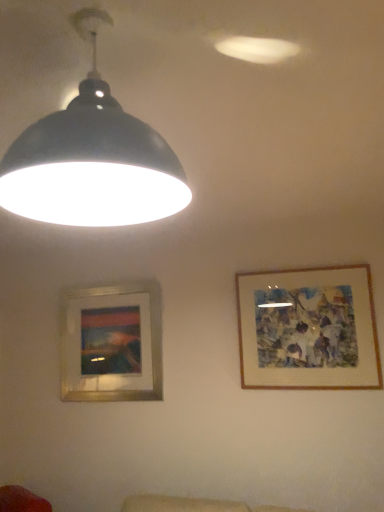
What is the approximate width of matte black lampshade at upper left?

41.38 centimeters.

Where is `wooden-framed artwork at upper right, which ranks as the first picture frame in front-to-back order`? The width and height of the screenshot is (384, 512). wooden-framed artwork at upper right, which ranks as the first picture frame in front-to-back order is located at coordinates (308, 329).

Measure the distance between silver metallic picture frame at lower left, the 1th picture frame positioned from the back, and matte black lampshade at upper left.

silver metallic picture frame at lower left, the 1th picture frame positioned from the back, and matte black lampshade at upper left are 2.10 meters apart from each other.

From their relative heights in the image, would you say silver metallic picture frame at lower left, the 1th picture frame positioned from the back, is taller or shorter than matte black lampshade at upper left?

In the image, silver metallic picture frame at lower left, the 1th picture frame positioned from the back, appears to be taller than matte black lampshade at upper left.

Is silver metallic picture frame at lower left, which ranks as the second picture frame in right-to-left order, far away from matte black lampshade at upper left?

Yes.

Considering the positions of objects silver metallic picture frame at lower left, which ranks as the second picture frame in right-to-left order, and wooden-framed artwork at upper right, acting as the 2th picture frame starting from the back, in the image provided, who is behind, silver metallic picture frame at lower left, which ranks as the second picture frame in right-to-left order, or wooden-framed artwork at upper right, acting as the 2th picture frame starting from the back,?

silver metallic picture frame at lower left, which ranks as the second picture frame in right-to-left order.

Which of these two, silver metallic picture frame at lower left, which ranks as the second picture frame in right-to-left order, or wooden-framed artwork at upper right, the first picture frame positioned from the right, stands shorter?

Standing shorter between the two is wooden-framed artwork at upper right, the first picture frame positioned from the right.

How many degrees apart are the facing directions of silver metallic picture frame at lower left, arranged as the 2th picture frame when viewed from the front, and wooden-framed artwork at upper right, acting as the 2th picture frame starting from the back?

The angular difference between silver metallic picture frame at lower left, arranged as the 2th picture frame when viewed from the front, and wooden-framed artwork at upper right, acting as the 2th picture frame starting from the back, is 0.00235 degrees.

The image size is (384, 512). Find the location of `picture frame below the wooden-framed artwork at upper right, which appears as the second picture frame when viewed from the left (from the image's perspective)`. picture frame below the wooden-framed artwork at upper right, which appears as the second picture frame when viewed from the left (from the image's perspective) is located at coordinates (111, 344).

Which object is wider, wooden-framed artwork at upper right, which ranks as the first picture frame in front-to-back order, or matte black lampshade at upper left?

matte black lampshade at upper left is wider.

Based on the photo, from a real-world perspective, does wooden-framed artwork at upper right, the first picture frame positioned from the right, sit lower than matte black lampshade at upper left?

Indeed, from a real-world perspective, wooden-framed artwork at upper right, the first picture frame positioned from the right, is positioned beneath matte black lampshade at upper left.

How far apart are wooden-framed artwork at upper right, which appears as the second picture frame when viewed from the left, and matte black lampshade at upper left?

A distance of 1.93 meters exists between wooden-framed artwork at upper right, which appears as the second picture frame when viewed from the left, and matte black lampshade at upper left.

Is wooden-framed artwork at upper right, the first picture frame positioned from the right, next to matte black lampshade at upper left and touching it?

No, wooden-framed artwork at upper right, the first picture frame positioned from the right, is not in contact with matte black lampshade at upper left.

Do you think wooden-framed artwork at upper right, which appears as the second picture frame when viewed from the left, is within silver metallic picture frame at lower left, arranged as the 2th picture frame when viewed from the front, or outside of it?

The correct answer is: outside.

In order to click on picture frame below the wooden-framed artwork at upper right, which ranks as the first picture frame in front-to-back order (from the image's perspective) in this screenshot , I will do point(111,344).

Considering the positions of objects wooden-framed artwork at upper right, the first picture frame positioned from the right, and silver metallic picture frame at lower left, arranged as the 2th picture frame when viewed from the front, in the image provided, who is more to the left, wooden-framed artwork at upper right, the first picture frame positioned from the right, or silver metallic picture frame at lower left, arranged as the 2th picture frame when viewed from the front,?

Positioned to the left is silver metallic picture frame at lower left, arranged as the 2th picture frame when viewed from the front.

Which of these two, wooden-framed artwork at upper right, which ranks as the first picture frame in front-to-back order, or silver metallic picture frame at lower left, the 1th picture frame positioned from the back, stands shorter?

Standing shorter between the two is wooden-framed artwork at upper right, which ranks as the first picture frame in front-to-back order.

From the image's perspective, which one is positioned lower, matte black lampshade at upper left or wooden-framed artwork at upper right, the first picture frame positioned from the right?

wooden-framed artwork at upper right, the first picture frame positioned from the right, is shown below in the image.

Which is more to the right, matte black lampshade at upper left or wooden-framed artwork at upper right, which appears as the second picture frame when viewed from the left?

wooden-framed artwork at upper right, which appears as the second picture frame when viewed from the left.

Looking at their sizes, would you say matte black lampshade at upper left is wider or thinner than wooden-framed artwork at upper right, which appears as the second picture frame when viewed from the left?

In the image, matte black lampshade at upper left appears to be wider than wooden-framed artwork at upper right, which appears as the second picture frame when viewed from the left.

Who is taller, matte black lampshade at upper left or wooden-framed artwork at upper right, which ranks as the first picture frame in front-to-back order?

With more height is wooden-framed artwork at upper right, which ranks as the first picture frame in front-to-back order.

Starting from the matte black lampshade at upper left, which picture frame is the 2nd one behind? Please provide its 2D coordinates.

[(111, 344)]

Which is more to the right, matte black lampshade at upper left or silver metallic picture frame at lower left, the 1th picture frame positioned from the back?

From the viewer's perspective, matte black lampshade at upper left appears more on the right side.

Is matte black lampshade at upper left turned away from silver metallic picture frame at lower left, which ranks as the second picture frame in right-to-left order?

No.

Between matte black lampshade at upper left and silver metallic picture frame at lower left, which ranks as the second picture frame in right-to-left order, which one has larger width?

Wider between the two is matte black lampshade at upper left.

Where is `lamp above the silver metallic picture frame at lower left, the first picture frame viewed from the left (from the image's perspective)`? This screenshot has height=512, width=384. lamp above the silver metallic picture frame at lower left, the first picture frame viewed from the left (from the image's perspective) is located at coordinates (92, 159).

At what (x,y) coordinates should I click in order to perform the action: click on picture frame above the silver metallic picture frame at lower left, the 1th picture frame positioned from the back (from a real-world perspective). Please return your answer as a coordinate pair (x, y). Looking at the image, I should click on (308, 329).

Looking at the image, which one is located closer to silver metallic picture frame at lower left, which ranks as the second picture frame in right-to-left order, wooden-framed artwork at upper right, the first picture frame positioned from the right, or matte black lampshade at upper left?

wooden-framed artwork at upper right, the first picture frame positioned from the right, is positioned closer to the anchor silver metallic picture frame at lower left, which ranks as the second picture frame in right-to-left order.

Considering their positions, is silver metallic picture frame at lower left, the 1th picture frame positioned from the back, positioned closer to wooden-framed artwork at upper right, which appears as the second picture frame when viewed from the left, than matte black lampshade at upper left?

silver metallic picture frame at lower left, the 1th picture frame positioned from the back.

Looking at this image, from the image, which object appears to be farther from matte black lampshade at upper left, silver metallic picture frame at lower left, arranged as the 2th picture frame when viewed from the front, or wooden-framed artwork at upper right, which appears as the second picture frame when viewed from the left?

silver metallic picture frame at lower left, arranged as the 2th picture frame when viewed from the front, lies further to matte black lampshade at upper left than the other object.

Considering their positions, is matte black lampshade at upper left positioned further to silver metallic picture frame at lower left, the first picture frame viewed from the left, than wooden-framed artwork at upper right, which ranks as the first picture frame in front-to-back order?

matte black lampshade at upper left.

Estimate the real-world distances between objects in this image. Which object is further from matte black lampshade at upper left, wooden-framed artwork at upper right, which ranks as the first picture frame in front-to-back order, or silver metallic picture frame at lower left, the first picture frame viewed from the left?

Among the two, silver metallic picture frame at lower left, the first picture frame viewed from the left, is located further to matte black lampshade at upper left.

Based on their spatial positions, is matte black lampshade at upper left or silver metallic picture frame at lower left, the 1th picture frame positioned from the back, further from wooden-framed artwork at upper right, which ranks as the first picture frame in front-to-back order?

Based on the image, matte black lampshade at upper left appears to be further to wooden-framed artwork at upper right, which ranks as the first picture frame in front-to-back order.

Image resolution: width=384 pixels, height=512 pixels. In order to click on picture frame between matte black lampshade at upper left and silver metallic picture frame at lower left, the first picture frame viewed from the left, in the front-back direction in this screenshot , I will do `click(308, 329)`.